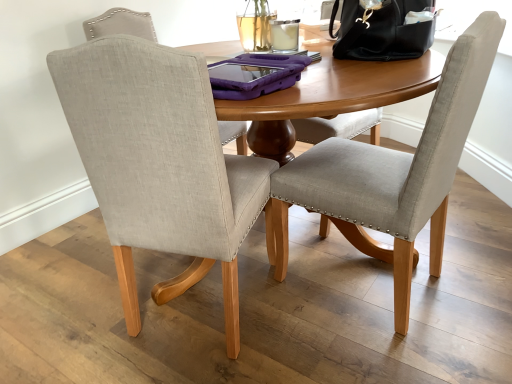
Locate an element on the screen. This screenshot has width=512, height=384. light gray fabric chair at center, arranged as the 2th chair when viewed from the left is located at coordinates (394, 172).

This screenshot has height=384, width=512. Describe the element at coordinates (394, 172) in the screenshot. I see `light gray fabric chair at center, which ranks as the 1th chair in right-to-left order` at that location.

What do you see at coordinates (383, 32) in the screenshot?
I see `black leather handbag at upper right` at bounding box center [383, 32].

The height and width of the screenshot is (384, 512). I want to click on beige fabric chair at center, the second chair in the right-to-left sequence, so click(x=161, y=164).

Which point is more distant from viewer, [113,90] or [421,40]?

The point [421,40] is farther from the camera.

Which of these two, beige fabric chair at center, which appears as the 1th chair when viewed from the left, or black leather handbag at upper right, is thinner?

black leather handbag at upper right is thinner.

From the image's perspective, who appears lower, beige fabric chair at center, the second chair in the right-to-left sequence, or black leather handbag at upper right?

From the image's view, beige fabric chair at center, the second chair in the right-to-left sequence, is below.

From a real-world perspective, between beige fabric chair at center, which appears as the 1th chair when viewed from the left, and black leather handbag at upper right, who is vertically higher?

black leather handbag at upper right.

Is point (282, 185) closer to viewer compared to point (383, 12)?

No.

Relative to black leather handbag at upper right, is light gray fabric chair at center, which ranks as the 1th chair in right-to-left order, in front or behind?

Visually, light gray fabric chair at center, which ranks as the 1th chair in right-to-left order, is located in front of black leather handbag at upper right.

Consider the image. Is light gray fabric chair at center, which ranks as the 1th chair in right-to-left order, turned away from black leather handbag at upper right?

No, light gray fabric chair at center, which ranks as the 1th chair in right-to-left order,'s orientation is not away from black leather handbag at upper right.

Can you tell me how much light gray fabric chair at center, arranged as the 2th chair when viewed from the left, and black leather handbag at upper right differ in facing direction?

The facing directions of light gray fabric chair at center, arranged as the 2th chair when viewed from the left, and black leather handbag at upper right are 3.81 degrees apart.

Considering the sizes of objects beige fabric chair at center, the second chair in the right-to-left sequence, and light gray fabric chair at center, arranged as the 2th chair when viewed from the left, in the image provided, who is thinner, beige fabric chair at center, the second chair in the right-to-left sequence, or light gray fabric chair at center, arranged as the 2th chair when viewed from the left,?

light gray fabric chair at center, arranged as the 2th chair when viewed from the left.

Is beige fabric chair at center, which appears as the 1th chair when viewed from the left, in front of or behind light gray fabric chair at center, arranged as the 2th chair when viewed from the left, in the image?

beige fabric chair at center, which appears as the 1th chair when viewed from the left, is in front of light gray fabric chair at center, arranged as the 2th chair when viewed from the left.

Is beige fabric chair at center, which appears as the 1th chair when viewed from the left, directly adjacent to light gray fabric chair at center, which ranks as the 1th chair in right-to-left order?

No.

Locate an element on the screen. chair below the light gray fabric chair at center, arranged as the 2th chair when viewed from the left (from the image's perspective) is located at coordinates (161, 164).

Between black leather handbag at upper right and light gray fabric chair at center, arranged as the 2th chair when viewed from the left, which one has smaller size?

With smaller size is black leather handbag at upper right.

Locate an element on the screen. Image resolution: width=512 pixels, height=384 pixels. handbag that appears behind the light gray fabric chair at center, which ranks as the 1th chair in right-to-left order is located at coordinates (383, 32).

Is light gray fabric chair at center, which ranks as the 1th chair in right-to-left order, a part of black leather handbag at upper right?

No, light gray fabric chair at center, which ranks as the 1th chair in right-to-left order, is not inside black leather handbag at upper right.

Are black leather handbag at upper right and light gray fabric chair at center, which ranks as the 1th chair in right-to-left order, making contact?

No, black leather handbag at upper right is not next to light gray fabric chair at center, which ranks as the 1th chair in right-to-left order.

From a real-world perspective, is black leather handbag at upper right located beneath beige fabric chair at center, the second chair in the right-to-left sequence?

No, from a real-world perspective, black leather handbag at upper right is not under beige fabric chair at center, the second chair in the right-to-left sequence.

Is black leather handbag at upper right next to beige fabric chair at center, the second chair in the right-to-left sequence, and touching it?

No, black leather handbag at upper right is not making contact with beige fabric chair at center, the second chair in the right-to-left sequence.

Between black leather handbag at upper right and beige fabric chair at center, the second chair in the right-to-left sequence, which one has smaller size?

black leather handbag at upper right.

Is black leather handbag at upper right in front of or behind beige fabric chair at center, which appears as the 1th chair when viewed from the left, in the image?

black leather handbag at upper right is behind beige fabric chair at center, which appears as the 1th chair when viewed from the left.

Between light gray fabric chair at center, which ranks as the 1th chair in right-to-left order, and beige fabric chair at center, which appears as the 1th chair when viewed from the left, which one is positioned behind?

light gray fabric chair at center, which ranks as the 1th chair in right-to-left order, is further away from the camera.

Which point is more forward, (464, 119) or (234, 343)?

The point (464, 119) is closer.

What are the coordinates of `chair located on the right of beige fabric chair at center, the second chair in the right-to-left sequence` in the screenshot? It's located at (394, 172).

Identify the location of chair that is the 2nd one when counting forward from the black leather handbag at upper right. (161, 164).

Identify the location of handbag above the light gray fabric chair at center, which ranks as the 1th chair in right-to-left order (from a real-world perspective). (383, 32).

Based on their spatial positions, is black leather handbag at upper right or beige fabric chair at center, which appears as the 1th chair when viewed from the left, closer to light gray fabric chair at center, which ranks as the 1th chair in right-to-left order?

Based on the image, beige fabric chair at center, which appears as the 1th chair when viewed from the left, appears to be nearer to light gray fabric chair at center, which ranks as the 1th chair in right-to-left order.

Considering their positions, is black leather handbag at upper right positioned further to beige fabric chair at center, which appears as the 1th chair when viewed from the left, than light gray fabric chair at center, which ranks as the 1th chair in right-to-left order?

black leather handbag at upper right lies further to beige fabric chair at center, which appears as the 1th chair when viewed from the left, than the other object.

Based on their spatial positions, is light gray fabric chair at center, arranged as the 2th chair when viewed from the left, or beige fabric chair at center, which appears as the 1th chair when viewed from the left, closer to black leather handbag at upper right?

Based on the image, light gray fabric chair at center, arranged as the 2th chair when viewed from the left, appears to be nearer to black leather handbag at upper right.

From the image, which object appears to be farther from light gray fabric chair at center, arranged as the 2th chair when viewed from the left, beige fabric chair at center, the second chair in the right-to-left sequence, or black leather handbag at upper right?

black leather handbag at upper right.

Estimate the real-world distances between objects in this image. Which object is closer to beige fabric chair at center, which appears as the 1th chair when viewed from the left, light gray fabric chair at center, which ranks as the 1th chair in right-to-left order, or black leather handbag at upper right?

Among the two, light gray fabric chair at center, which ranks as the 1th chair in right-to-left order, is located nearer to beige fabric chair at center, which appears as the 1th chair when viewed from the left.

From the image, which object appears to be nearer to black leather handbag at upper right, beige fabric chair at center, which appears as the 1th chair when viewed from the left, or light gray fabric chair at center, arranged as the 2th chair when viewed from the left?

Among the two, light gray fabric chair at center, arranged as the 2th chair when viewed from the left, is located nearer to black leather handbag at upper right.

This screenshot has width=512, height=384. Find the location of `chair between beige fabric chair at center, the second chair in the right-to-left sequence, and black leather handbag at upper right`. chair between beige fabric chair at center, the second chair in the right-to-left sequence, and black leather handbag at upper right is located at coordinates (394, 172).